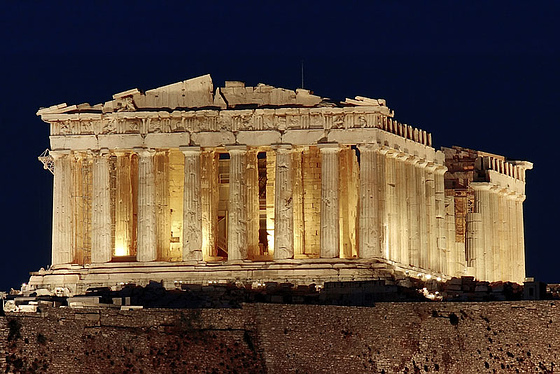
Find the location of a particular element. The width and height of the screenshot is (560, 374). entrance is located at coordinates (223, 240).